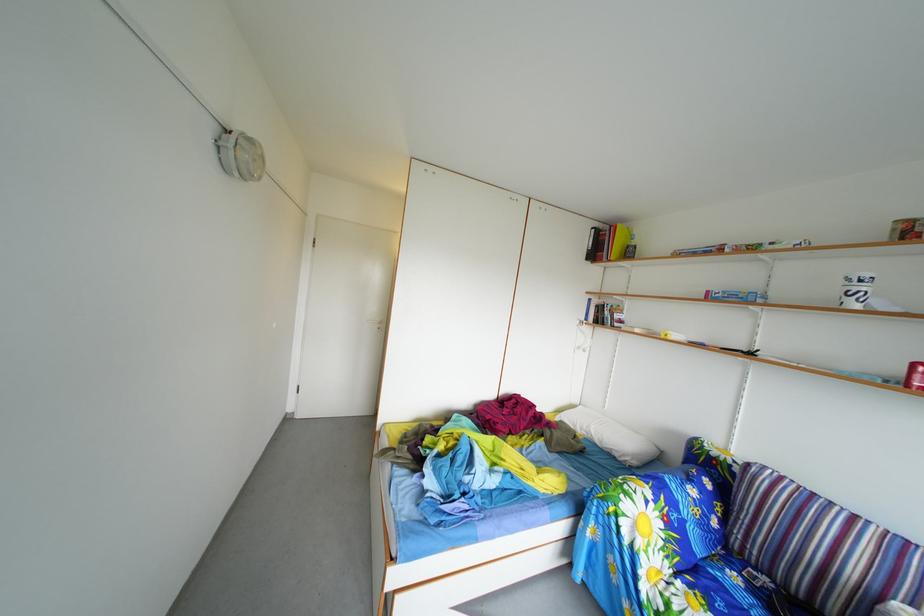
Find where to lift the red cylindrical can. Please return your answer as a coordinate pair (x, y).

(915, 376)